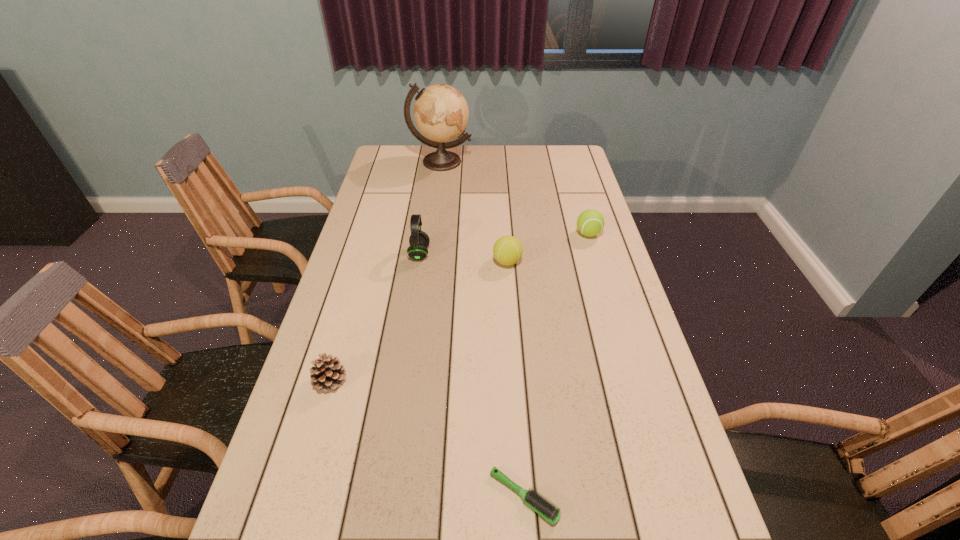
Where is `vacant space located on the front-facing side of the farthest object`? This screenshot has width=960, height=540. vacant space located on the front-facing side of the farthest object is located at coordinates (431, 235).

The image size is (960, 540). I want to click on free space located on the ear cups of the headset, so click(507, 254).

Find the location of a particular element. free space located 0.090m on the right of the nearer tennis ball is located at coordinates (550, 262).

At what (x,y) coordinates should I click in order to perform the action: click on vacant area situated 0.310m on the left of the rightmost object. Please return your answer as a coordinate pair (x, y). Looking at the image, I should click on click(484, 234).

Where is `vacant region located 0.200m on the front of the leftmost object`? vacant region located 0.200m on the front of the leftmost object is located at coordinates (301, 481).

The height and width of the screenshot is (540, 960). I want to click on blank space located on the back of the nearest object, so click(519, 429).

Locate an element on the screen. This screenshot has width=960, height=540. object that is at the far edge is located at coordinates (441, 113).

I want to click on globe at the left edge, so click(x=441, y=113).

Identify the location of pinecone that is positioned at the left edge. The image size is (960, 540). (328, 373).

The height and width of the screenshot is (540, 960). I want to click on object that is at the right edge, so click(590, 222).